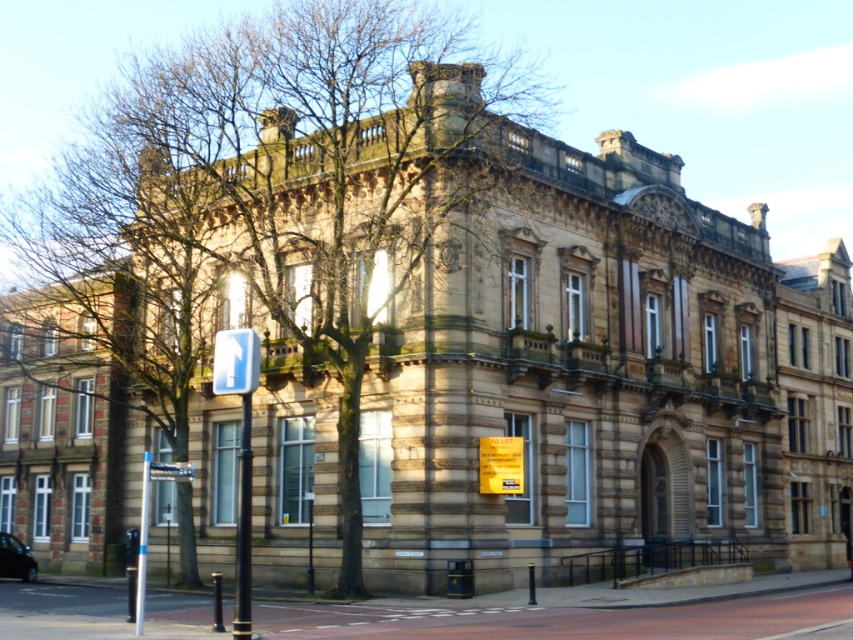
You are standing at the entrance of the grand historic building and want to find the silver metallic pole at lower left. According to the image, where should you look relative to your position?

The silver metallic pole at lower left is located at point (148, 518), which would be to your lower left direction from the entrance.